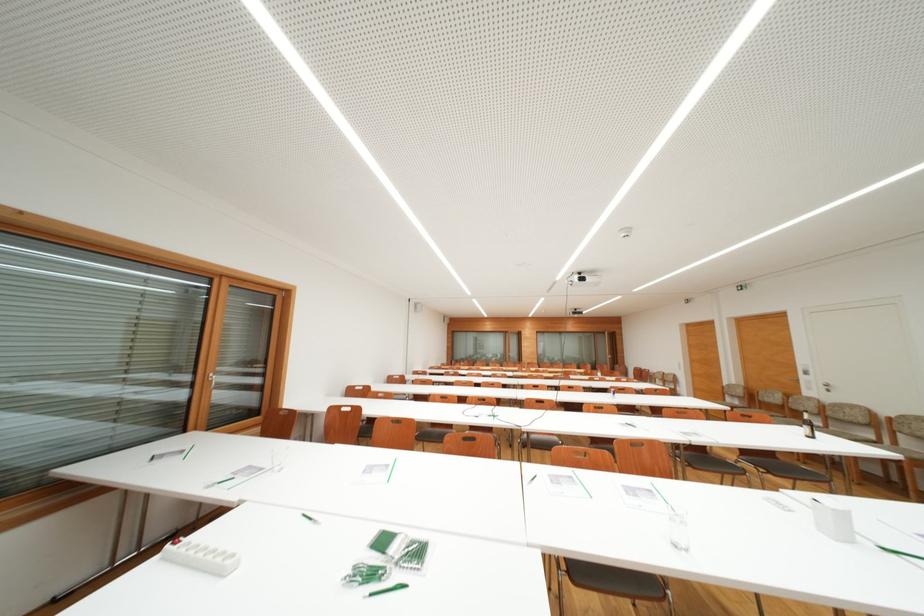
Where is `metal door handle`? The image size is (924, 616). metal door handle is located at coordinates (825, 387).